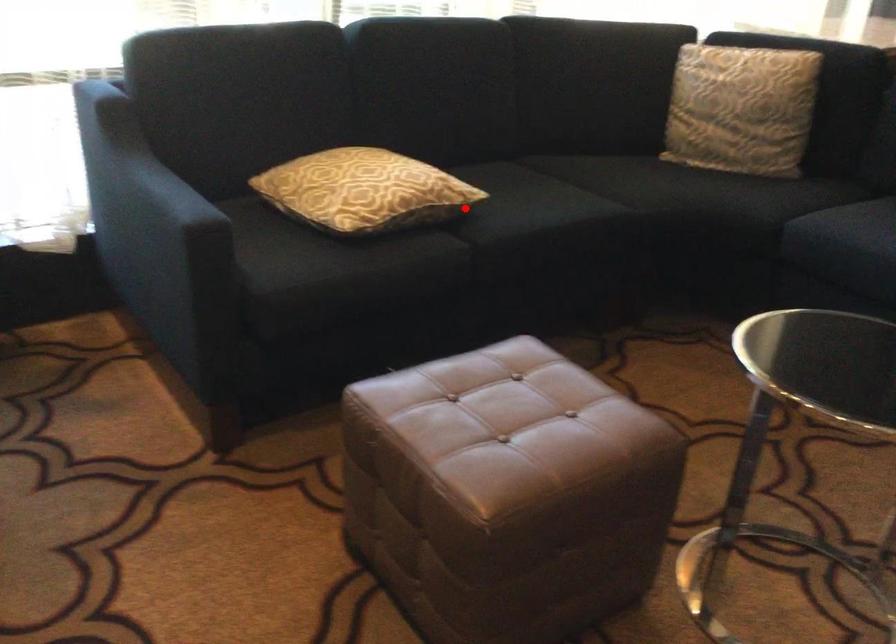
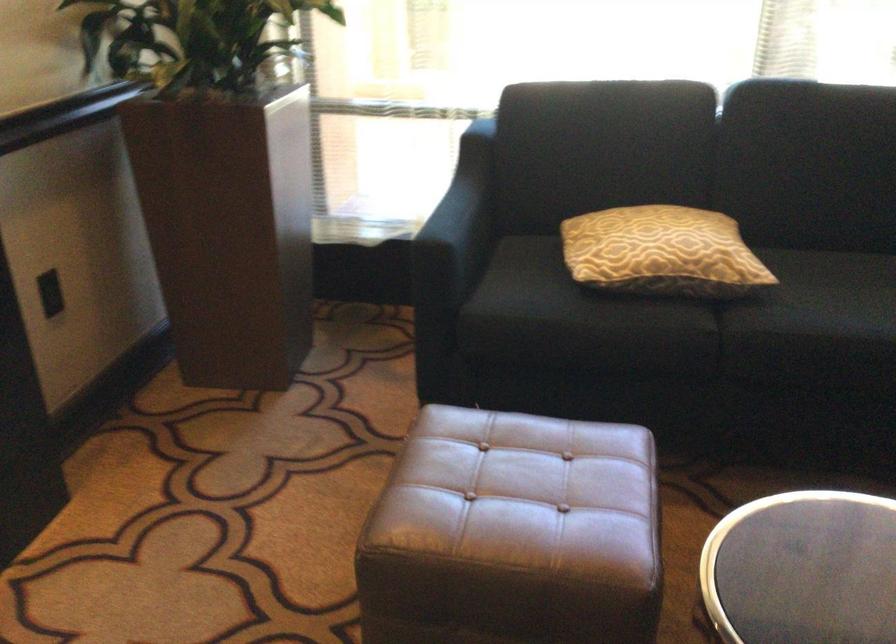
Question: I am providing you with two images of the same scene from different viewpoints. Image1 has a red point marked. In image2, the corresponding 3D location appears at what relative position? Reply with the corresponding letter.

Choices:
 (A) Closer
 (B) Farther

Answer: (A)